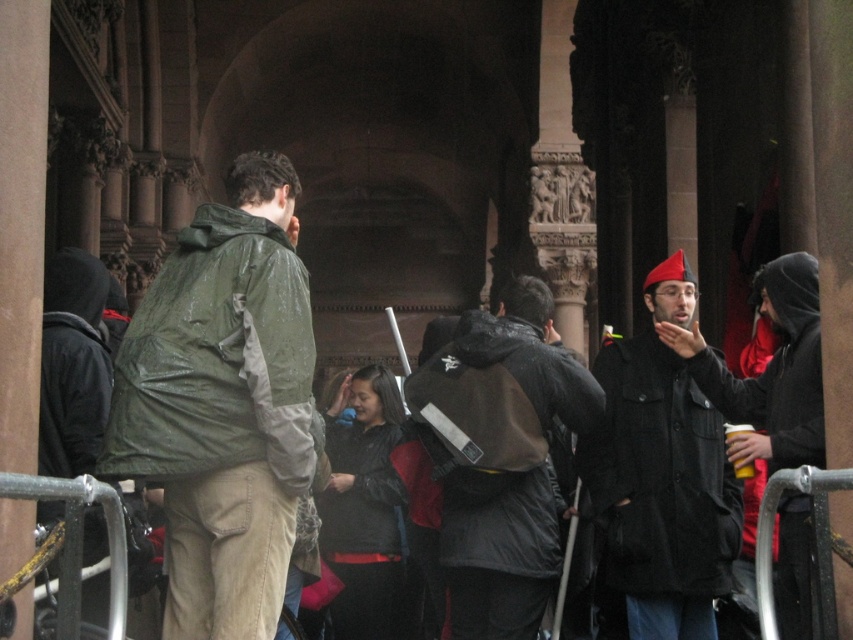
You are standing at the point marked as point (218, 360) in this outdoor scene with columns. Which object is exactly at that coordinate?

The green matte jacket at left is exactly at point (218, 360).

You are standing at the base of the columns in the image and want to hand a document to the person wearing the green matte jacket at left and the dark gray matte jacket at center. If you can only move forward in a straight line, which jacket wearer will you reach first?

The green matte jacket at left is 34.70 feet away from the dark gray matte jacket at center. Since you are moving forward in a straight line, you will reach the person wearing the green matte jacket at left first because they are closer to you than the dark gray matte jacket at center.